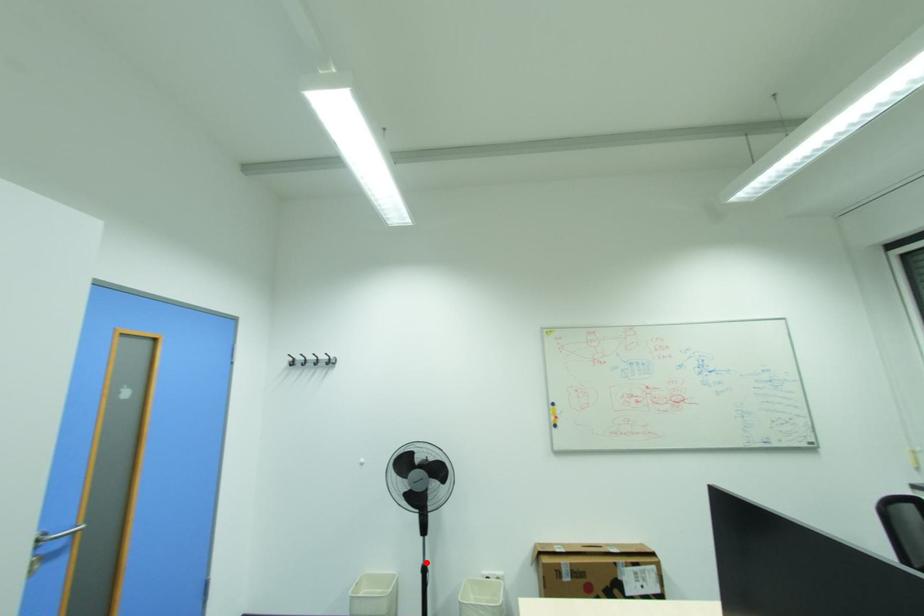
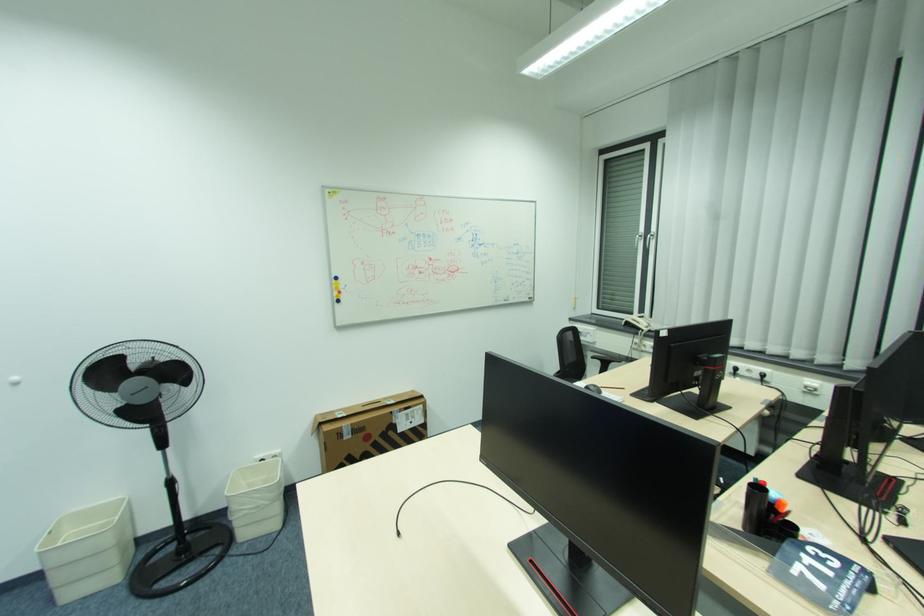
In the second image, find the point that corresponds to the highlighted location in the first image.

(169, 477)